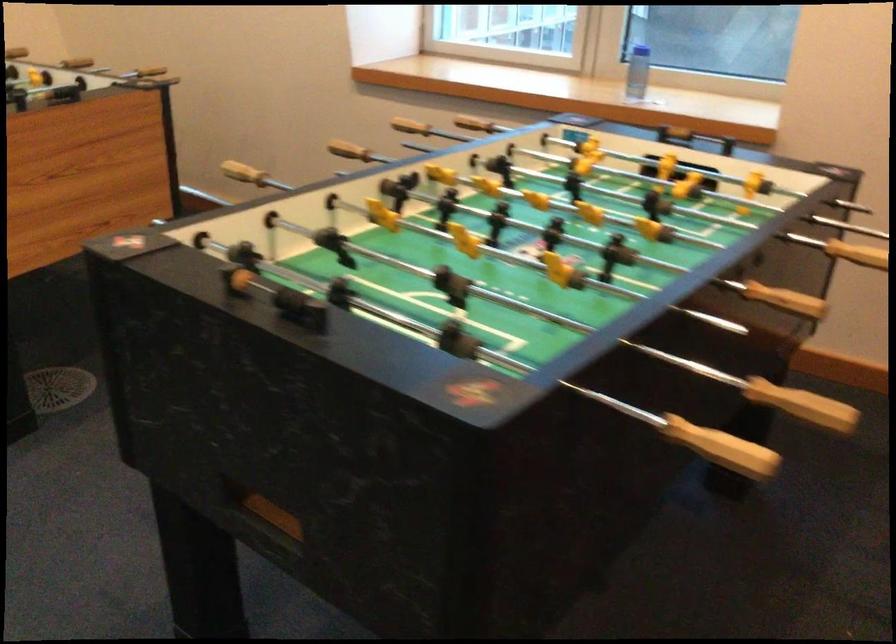
Find where to reach the foosball ball return. Please return your answer as a coordinate pair (x, y).

(678, 172)